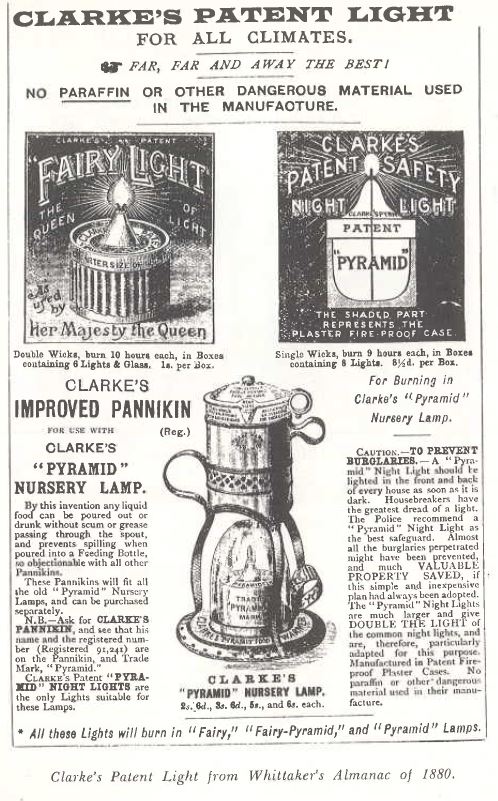
Find the location of a particular element. pyramid nursery lamp is located at coordinates (249, 541).